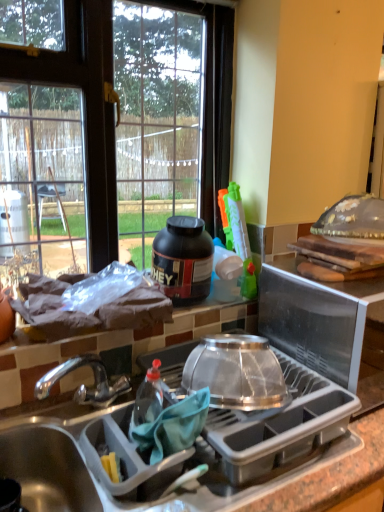
Identify the location of transparent plastic bowl at center, which is the second kitchen appliance in top-to-bottom order. The image size is (384, 512). (236, 372).

Image resolution: width=384 pixels, height=512 pixels. Identify the location of matte gray sink at lower left. (46, 467).

The width and height of the screenshot is (384, 512). What do you see at coordinates (280, 425) in the screenshot?
I see `transparent plastic bowl at center, which ranks as the 1th appliance in left-to-right order` at bounding box center [280, 425].

Measure the distance between transparent plastic bowl at center, which appears as the second appliance when viewed from the right, and camera.

The distance of transparent plastic bowl at center, which appears as the second appliance when viewed from the right, from camera is 81.13 centimeters.

The height and width of the screenshot is (512, 384). What are the coordinates of `transparent plastic bowl at center, which is the 1th kitchen appliance in front-to-back order` in the screenshot? It's located at (236, 372).

This screenshot has height=512, width=384. I want to click on window that is above the matte gray sink at lower left (from the image's perspective), so click(110, 127).

What's the angular difference between matte gray sink at lower left and transparent glass window at upper left's facing directions?

0.477 degrees separate the facing orientations of matte gray sink at lower left and transparent glass window at upper left.

From a real-world perspective, relative to transparent glass window at upper left, is matte gray sink at lower left vertically above or below?

In terms of real-world spatial position, matte gray sink at lower left is below transparent glass window at upper left.

Is gray plastic dish rack at center positioned with its back to matte gray sink at lower left?

No, gray plastic dish rack at center is not facing away from matte gray sink at lower left.

Which point is more forward, (5,380) or (2,441)?

The point (2,441) is closer.

Considering the positions of objects gray plastic dish rack at center and matte gray sink at lower left in the image provided, who is behind, gray plastic dish rack at center or matte gray sink at lower left?

matte gray sink at lower left is behind.

From a real-world perspective, relative to matte gray sink at lower left, is gray plastic dish rack at center vertically above or below?

Clearly, from a real-world perspective, gray plastic dish rack at center is below matte gray sink at lower left.

Considering the positions of objects black matte protein jar at upper center, the 2th kitchen appliance viewed from the front, and transparent plastic bowl at center, which ranks as the 1th appliance in left-to-right order, in the image provided, who is more to the left, black matte protein jar at upper center, the 2th kitchen appliance viewed from the front, or transparent plastic bowl at center, which ranks as the 1th appliance in left-to-right order,?

black matte protein jar at upper center, the 2th kitchen appliance viewed from the front, is more to the left.

Is transparent plastic bowl at center, which appears as the second appliance when viewed from the right, a part of black matte protein jar at upper center, the 2th kitchen appliance viewed from the front?

No.

How many degrees apart are the facing directions of black matte protein jar at upper center, placed as the 2th kitchen appliance when sorted from bottom to top, and transparent plastic bowl at center, which ranks as the 1th appliance in left-to-right order?

The angular difference between black matte protein jar at upper center, placed as the 2th kitchen appliance when sorted from bottom to top, and transparent plastic bowl at center, which ranks as the 1th appliance in left-to-right order, is 2.95 degrees.

From a real-world perspective, relative to transparent plastic bowl at center, which appears as the second appliance when viewed from the right, is black matte protein jar at upper center, the first kitchen appliance when ordered from top to bottom, vertically above or below?

Clearly, from a real-world perspective, black matte protein jar at upper center, the first kitchen appliance when ordered from top to bottom, is above transparent plastic bowl at center, which appears as the second appliance when viewed from the right.

Considering their positions, is matte gray sink at lower left located in front of or behind transparent plastic bowl at center, which appears as the second appliance when viewed from the right?

Clearly, matte gray sink at lower left is in front of transparent plastic bowl at center, which appears as the second appliance when viewed from the right.

In the scene shown: Which of these two, matte gray sink at lower left or transparent plastic bowl at center, which appears as the second appliance when viewed from the right, stands taller?

Standing taller between the two is matte gray sink at lower left.

Are matte gray sink at lower left and transparent plastic bowl at center, which ranks as the 1th appliance in left-to-right order, located far from each other?

No.

From a real-world perspective, which is physically above, matte gray sink at lower left or transparent plastic bowl at center, which appears as the second appliance when viewed from the right?

transparent plastic bowl at center, which appears as the second appliance when viewed from the right.

Is point (308, 379) more distant than point (179, 287)?

That is False.

Consider the image. Is transparent plastic bowl at center, which appears as the second appliance when viewed from the right, aimed at black matte protein jar at upper center, the first kitchen appliance when ordered from top to bottom?

No, transparent plastic bowl at center, which appears as the second appliance when viewed from the right, does not turn towards black matte protein jar at upper center, the first kitchen appliance when ordered from top to bottom.

Which is more to the left, transparent plastic bowl at center, which ranks as the 1th appliance in left-to-right order, or black matte protein jar at upper center, placed as the 2th kitchen appliance when sorted from bottom to top?

black matte protein jar at upper center, placed as the 2th kitchen appliance when sorted from bottom to top.

From the image's perspective, is transparent plastic bowl at center, which ranks as the 1th appliance in left-to-right order, located beneath black matte protein jar at upper center, placed as the 2th kitchen appliance when sorted from bottom to top?

Yes, from the image's perspective, transparent plastic bowl at center, which ranks as the 1th appliance in left-to-right order, is beneath black matte protein jar at upper center, placed as the 2th kitchen appliance when sorted from bottom to top.

Considering the relative sizes of transparent plastic lid at upper right, the 2th appliance from the left, and black matte protein jar at upper center, arranged as the 1th kitchen appliance when viewed from the back, in the image provided, is transparent plastic lid at upper right, the 2th appliance from the left, thinner than black matte protein jar at upper center, arranged as the 1th kitchen appliance when viewed from the back,?

No.

Which is more to the right, transparent plastic lid at upper right, the 1th appliance when ordered from right to left, or black matte protein jar at upper center, the 2th kitchen appliance viewed from the front?

Positioned to the right is transparent plastic lid at upper right, the 1th appliance when ordered from right to left.

Between transparent plastic lid at upper right, the 1th appliance when ordered from right to left, and black matte protein jar at upper center, the 2th kitchen appliance viewed from the front, which one has less height?

Standing shorter between the two is black matte protein jar at upper center, the 2th kitchen appliance viewed from the front.

Consider the image. From a real-world perspective, is transparent plastic lid at upper right, the 1th appliance when ordered from right to left, beneath black matte protein jar at upper center, the first kitchen appliance when ordered from top to bottom?

Indeed, from a real-world perspective, transparent plastic lid at upper right, the 1th appliance when ordered from right to left, is positioned beneath black matte protein jar at upper center, the first kitchen appliance when ordered from top to bottom.

Is transparent plastic bowl at center, which is the second kitchen appliance in top-to-bottom order, at the back of transparent glass window at upper left?

No.

Is transparent glass window at upper left surrounding transparent plastic bowl at center, the 1th kitchen appliance positioned from the bottom?

Definitely not — transparent plastic bowl at center, the 1th kitchen appliance positioned from the bottom, is not inside transparent glass window at upper left.

Where is `window on the left of transparent plastic bowl at center, the 2th kitchen appliance when ordered from back to front`? window on the left of transparent plastic bowl at center, the 2th kitchen appliance when ordered from back to front is located at coordinates pos(110,127).

From the image's perspective, who appears lower, transparent glass window at upper left or transparent plastic bowl at center, which is the 1th kitchen appliance in front-to-back order?

From the image's view, transparent plastic bowl at center, which is the 1th kitchen appliance in front-to-back order, is below.

At what (x,y) coordinates should I click in order to perform the action: click on window that appears above the matte gray sink at lower left (from the image's perspective). Please return your answer as a coordinate pair (x, y). Looking at the image, I should click on (110, 127).

There is a gray plastic dish rack at center. Where is `sink above it (from a real-world perspective)`? The width and height of the screenshot is (384, 512). sink above it (from a real-world perspective) is located at coordinates (46, 467).

Considering their positions, is transparent glass window at upper left positioned closer to transparent plastic lid at upper right, the 2th appliance from the left, than gray plastic dish rack at center?

Among the two, gray plastic dish rack at center is located nearer to transparent plastic lid at upper right, the 2th appliance from the left.

From the image, which object appears to be nearer to gray plastic dish rack at center, black matte protein jar at upper center, the first kitchen appliance when ordered from top to bottom, or matte gray sink at lower left?

black matte protein jar at upper center, the first kitchen appliance when ordered from top to bottom, is positioned closer to the anchor gray plastic dish rack at center.

Looking at the image, which one is located closer to gray plastic dish rack at center, transparent plastic lid at upper right, the 1th appliance when ordered from right to left, or transparent plastic bowl at center, which appears as the second appliance when viewed from the right?

transparent plastic lid at upper right, the 1th appliance when ordered from right to left, lies closer to gray plastic dish rack at center than the other object.

Which object lies nearer to the anchor point transparent plastic bowl at center, which is the second kitchen appliance in top-to-bottom order, black matte protein jar at upper center, arranged as the 1th kitchen appliance when viewed from the back, or transparent plastic lid at upper right, the 2th appliance from the left?

transparent plastic lid at upper right, the 2th appliance from the left, is closer to transparent plastic bowl at center, which is the second kitchen appliance in top-to-bottom order.

Which object lies nearer to the anchor point transparent plastic bowl at center, which appears as the second appliance when viewed from the right, transparent plastic bowl at center, which is the 1th kitchen appliance in front-to-back order, or black matte protein jar at upper center, arranged as the 1th kitchen appliance when viewed from the back?

transparent plastic bowl at center, which is the 1th kitchen appliance in front-to-back order, lies closer to transparent plastic bowl at center, which appears as the second appliance when viewed from the right, than the other object.

Estimate the real-world distances between objects in this image. Which object is further from gray plastic dish rack at center, black matte protein jar at upper center, arranged as the 1th kitchen appliance when viewed from the back, or transparent plastic bowl at center, which is the 1th kitchen appliance in front-to-back order?

transparent plastic bowl at center, which is the 1th kitchen appliance in front-to-back order, is further to gray plastic dish rack at center.

Which object lies nearer to the anchor point transparent plastic bowl at center, which is the 1th kitchen appliance in front-to-back order, transparent glass window at upper left or black matte protein jar at upper center, the first kitchen appliance when ordered from top to bottom?

black matte protein jar at upper center, the first kitchen appliance when ordered from top to bottom, is positioned closer to the anchor transparent plastic bowl at center, which is the 1th kitchen appliance in front-to-back order.

Considering their positions, is gray plastic dish rack at center positioned further to matte gray sink at lower left than black matte protein jar at upper center, the 2th kitchen appliance viewed from the front?

Based on the image, black matte protein jar at upper center, the 2th kitchen appliance viewed from the front, appears to be further to matte gray sink at lower left.

In order to click on countertop between matte gray sink at lower left and transparent plastic bowl at center, which ranks as the 1th appliance in left-to-right order, in the horizontal direction in this screenshot , I will do `click(221, 331)`.

Locate an element on the screen. countertop between matte gray sink at lower left and transparent plastic bowl at center, the 1th kitchen appliance positioned from the bottom is located at coordinates (221, 331).

Locate an element on the screen. The image size is (384, 512). sink between transparent glass window at upper left and transparent plastic lid at upper right, the 1th appliance when ordered from right to left, in the horizontal direction is located at coordinates (46, 467).

Where is `appliance between transparent glass window at upper left and transparent plastic bowl at center, which ranks as the 1th appliance in left-to-right order, in the vertical direction`? appliance between transparent glass window at upper left and transparent plastic bowl at center, which ranks as the 1th appliance in left-to-right order, in the vertical direction is located at coordinates (316, 318).